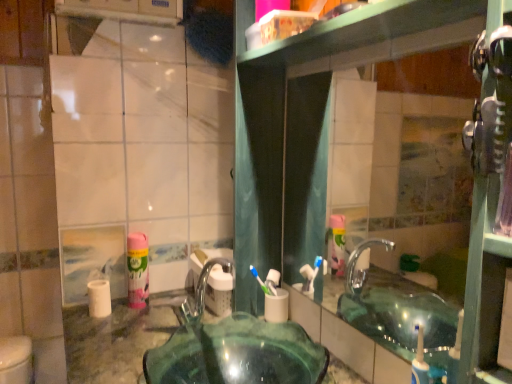
You are a GUI agent. You are given a task and a screenshot of the screen. Output one action in this format:
    pyautogui.click(x=<x>, y=<y>)
    Task: Click on the free spot above transparent glass sink at center (from a real-world perspective)
    
    Given the screenshot: What is the action you would take?
    pyautogui.click(x=163, y=331)